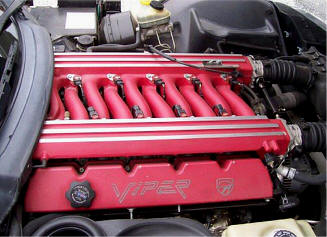
The height and width of the screenshot is (237, 327). I want to click on box, so click(x=148, y=18).